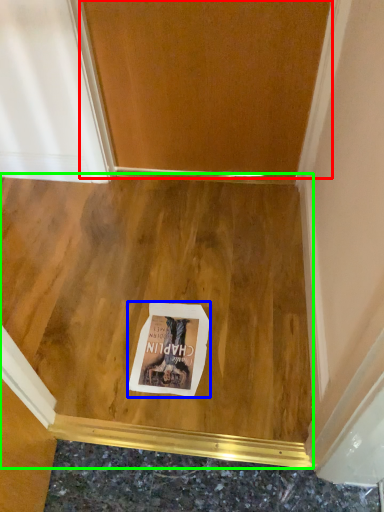
Question: Estimate the real-world distances between objects in this image. Which object is closer to door (highlighted by a red box), postcard (highlighted by a blue box) or plywood (highlighted by a green box)?

Choices:
 (A) postcard
 (B) plywood

Answer: (B)